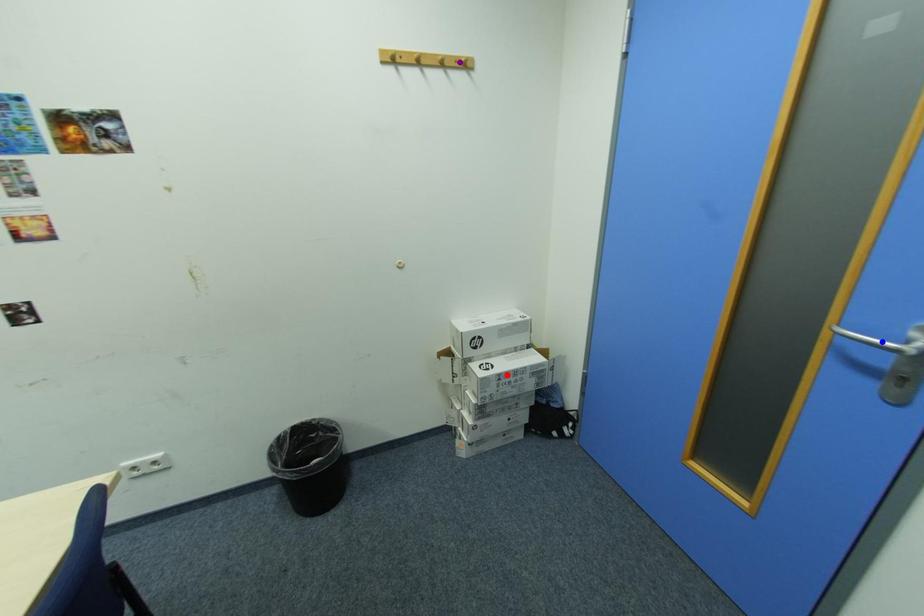
Order these from nearest to farthest:
red point, blue point, purple point

red point
purple point
blue point